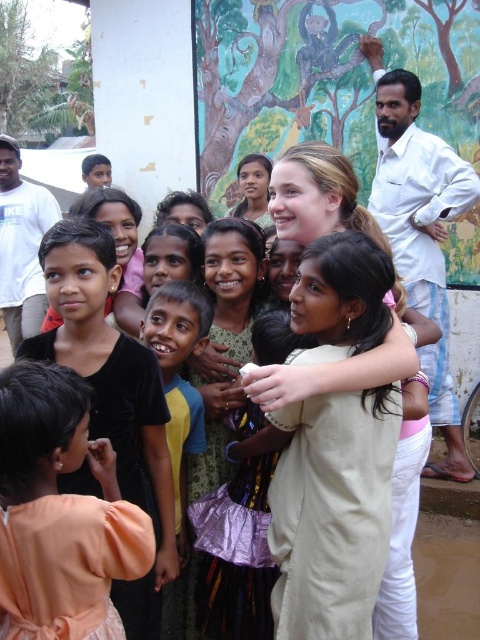
You are a photographer trying to capture a photo of the children in the scene. You notice two dresses in the image, the beige cotton dress at center and the light peach fabric dress at lower left. Which dress is closer to the camera?

The beige cotton dress at center is positioned under the light peach fabric dress at lower left, which means the light peach fabric dress at lower left is closer to the camera.

You are an interior designer planning to add a new painting to the wall where the painted mural at upper center and the light peach fabric dress at lower left are located. Considering their sizes, which object should you consider for placement adjustments to ensure the new painting has enough space?

The painted mural at upper center occupies less space than the light peach fabric dress at lower left, so you should consider adjusting the placement of the light peach fabric dress at lower left to free up more space for the new painting.

You are a photographer standing at the edge of the scene. You want to take a photo that includes both the beige cotton dress at center and the white cotton shirt at right. What is the minimum distance you need to move backward to ensure both are in frame?

The beige cotton dress at center and white cotton shirt at right are 4.53 meters apart from each other. To include both in the frame, you need to move back at least 4.53 meters so that the camera can capture the entire distance between them.